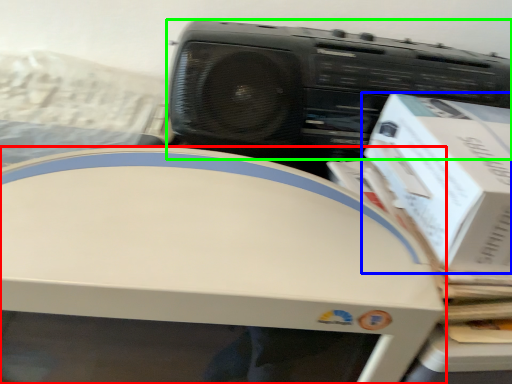
Question: Estimate the real-world distances between objects in this image. Which object is farther from home appliance (highlighted by a red box), box (highlighted by a blue box) or cassette (highlighted by a green box)?

Choices:
 (A) box
 (B) cassette

Answer: (B)